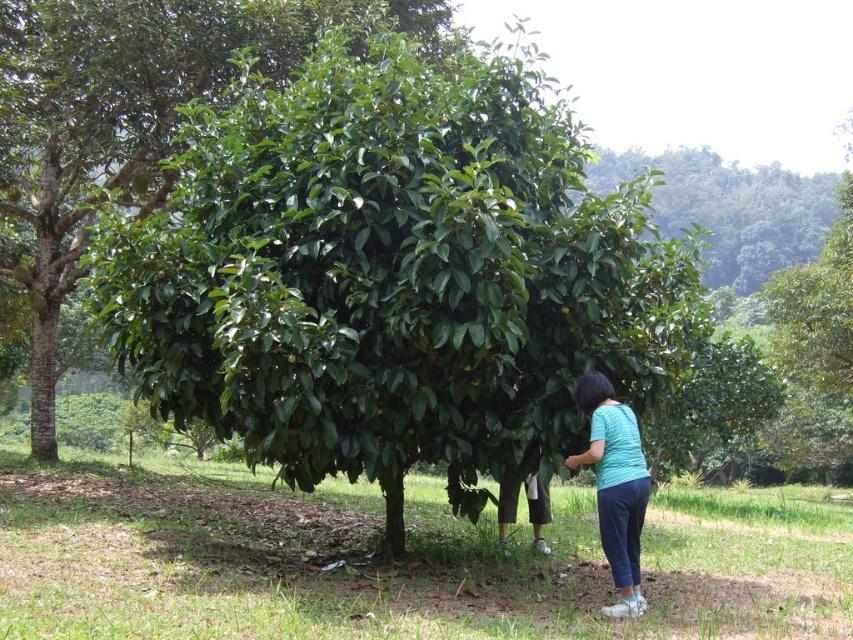
Can you confirm if green glossy leaves at center is smaller than dark blue cotton pants at lower center?

Correct, green glossy leaves at center occupies less space than dark blue cotton pants at lower center.

Does green glossy leaves at center have a lesser height compared to dark blue cotton pants at lower center?

Yes.

Where is `green glossy leaves at center`? The width and height of the screenshot is (853, 640). green glossy leaves at center is located at coordinates point(393,273).

Find the location of `green glossy leaves at center`. green glossy leaves at center is located at coordinates pyautogui.click(x=393, y=273).

Locate an element on the screen. This screenshot has width=853, height=640. green glossy leaves at center is located at coordinates (393, 273).

Which is more to the left, green glossy leaves at center or teal fabric shirt at center?

Positioned to the left is green glossy leaves at center.

The width and height of the screenshot is (853, 640). What do you see at coordinates (393, 273) in the screenshot?
I see `green glossy leaves at center` at bounding box center [393, 273].

In order to click on green glossy leaves at center in this screenshot , I will do `click(393, 273)`.

Who is higher up, green glossy tree at center or teal fabric shirt at center?

green glossy tree at center is higher up.

Is green glossy tree at center above teal fabric shirt at center?

Correct, green glossy tree at center is located above teal fabric shirt at center.

In order to click on green glossy tree at center in this screenshot , I will do `click(123, 120)`.

You are a GUI agent. You are given a task and a screenshot of the screen. Output one action in this format:
    pyautogui.click(x=<x>, y=<y>)
    Task: Click on the green glossy tree at center
    This screenshot has width=853, height=640.
    Given the screenshot: What is the action you would take?
    pyautogui.click(x=123, y=120)